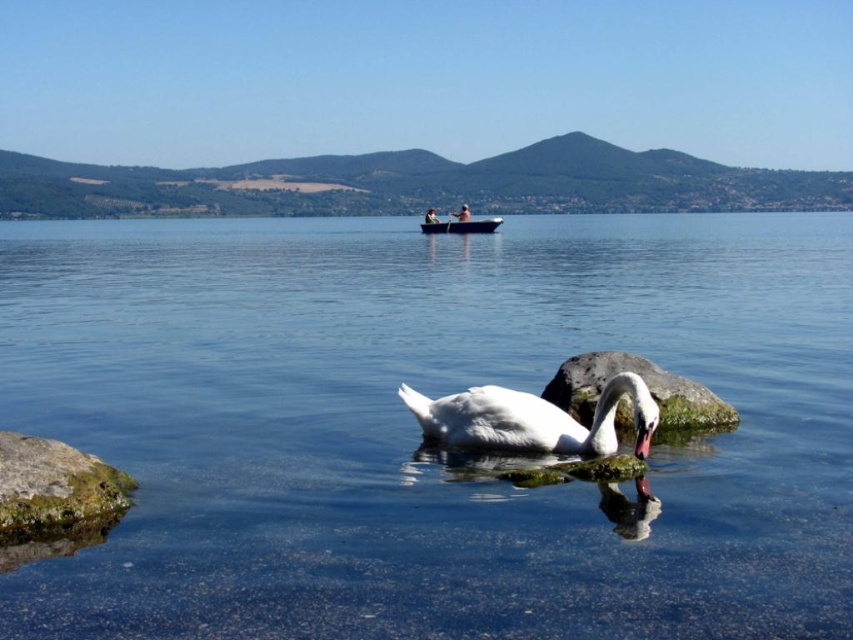
Where is `clear water at center`? The height and width of the screenshot is (640, 853). clear water at center is located at coordinates (419, 429).

Can you confirm if white glossy swan at center is positioned to the right of green mossy rock at lower left?

Correct, you'll find white glossy swan at center to the right of green mossy rock at lower left.

Does white glossy swan at center have a lesser height compared to green mossy rock at lower left?

No.

Between point (485, 397) and point (7, 499), which one is positioned in front?

Point (7, 499) is more forward.

Where is `white glossy swan at center`? Image resolution: width=853 pixels, height=640 pixels. white glossy swan at center is located at coordinates (532, 419).

Does clear water at center appear over gray smooth rock at center?

Yes, clear water at center is above gray smooth rock at center.

Does point (502, 236) lie behind point (693, 385)?

That is True.

Find the location of a particular element. This screenshot has height=640, width=853. clear water at center is located at coordinates (x=419, y=429).